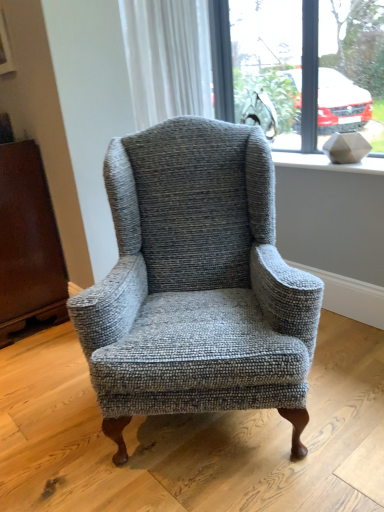
Question: Can you confirm if white textured curtain at upper center is bigger than clear glass window at upper center?

Choices:
 (A) yes
 (B) no

Answer: (A)

Question: Considering the relative sizes of white textured curtain at upper center and clear glass window at upper center in the image provided, is white textured curtain at upper center wider than clear glass window at upper center?

Choices:
 (A) no
 (B) yes

Answer: (B)

Question: Is white textured curtain at upper center outside of clear glass window at upper center?

Choices:
 (A) yes
 (B) no

Answer: (A)

Question: Are white textured curtain at upper center and clear glass window at upper center located far from each other?

Choices:
 (A) no
 (B) yes

Answer: (A)

Question: Is white textured curtain at upper center turned away from clear glass window at upper center?

Choices:
 (A) yes
 (B) no

Answer: (B)

Question: From their relative heights in the image, would you say white textured curtain at upper center is taller or shorter than clear glass window at upper center?

Choices:
 (A) tall
 (B) short

Answer: (B)

Question: From the image's perspective, is white textured curtain at upper center located above or below clear glass window at upper center?

Choices:
 (A) above
 (B) below

Answer: (A)

Question: Is point (137, 72) positioned closer to the camera than point (283, 105)?

Choices:
 (A) farther
 (B) closer

Answer: (B)

Question: Choose the correct answer: Is white textured curtain at upper center inside clear glass window at upper center or outside it?

Choices:
 (A) outside
 (B) inside

Answer: (A)

Question: Is white textured curtain at upper center situated inside brown leather armoire at left or outside?

Choices:
 (A) outside
 (B) inside

Answer: (A)

Question: Is white textured curtain at upper center in front of or behind brown leather armoire at left in the image?

Choices:
 (A) front
 (B) behind

Answer: (B)

Question: Is white textured curtain at upper center taller or shorter than brown leather armoire at left?

Choices:
 (A) short
 (B) tall

Answer: (A)

Question: From the image's perspective, is white textured curtain at upper center above or below brown leather armoire at left?

Choices:
 (A) below
 (B) above

Answer: (B)

Question: From a real-world perspective, is textured gray armchair at center positioned above or below clear glass window at upper center?

Choices:
 (A) below
 (B) above

Answer: (A)

Question: Considering the positions of point (195, 292) and point (329, 8), is point (195, 292) closer or farther from the camera than point (329, 8)?

Choices:
 (A) farther
 (B) closer

Answer: (B)